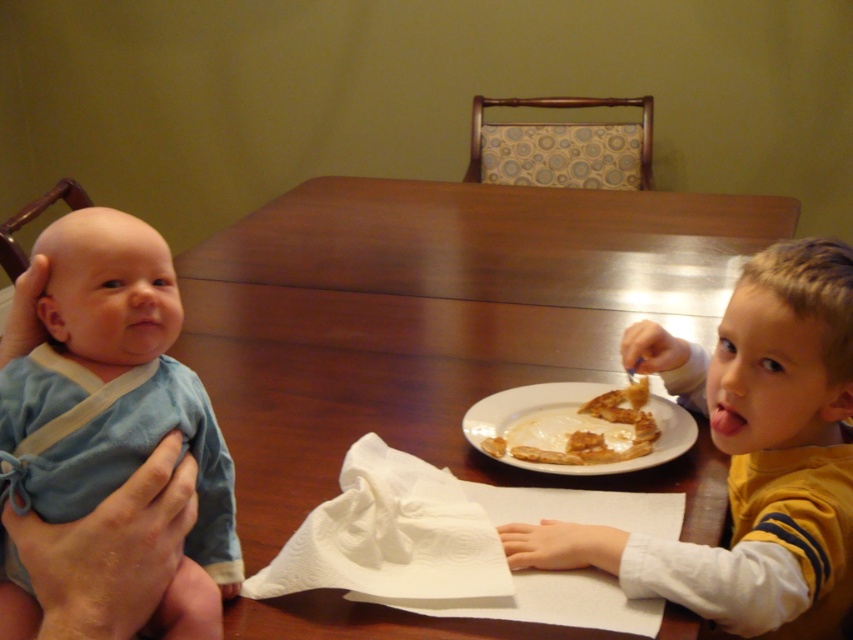
Based on the photo, does blue cotton baby at left appear under golden brown crispy pastry at center?

Incorrect, blue cotton baby at left is not positioned below golden brown crispy pastry at center.

Can you confirm if blue cotton baby at left is wider than golden brown crispy pastry at center?

No.

Which is behind, point (117, 211) or point (601, 413)?

The point (601, 413) is more distant.

I want to click on blue cotton baby at left, so click(x=119, y=401).

Between yellow striped shirt at right and golden brown crispy pastry at center, which one has less height?

Standing shorter between the two is golden brown crispy pastry at center.

Who is positioned more to the right, yellow striped shirt at right or golden brown crispy pastry at center?

Positioned to the right is yellow striped shirt at right.

Find the location of a particular element. The width and height of the screenshot is (853, 640). yellow striped shirt at right is located at coordinates (749, 456).

Between yellow striped shirt at right and blue cotton baby at left, which one is positioned higher?

blue cotton baby at left is above.

Does yellow striped shirt at right have a larger size compared to blue cotton baby at left?

Yes, yellow striped shirt at right is bigger than blue cotton baby at left.

Find the location of a particular element. The image size is (853, 640). yellow striped shirt at right is located at coordinates (749, 456).